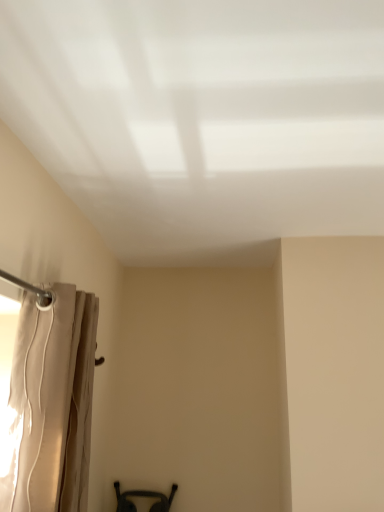
The image size is (384, 512). Describe the element at coordinates (53, 401) in the screenshot. I see `beige fabric curtain at left` at that location.

Find the location of a particular element. beige fabric curtain at left is located at coordinates (53, 401).

I want to click on beige fabric curtain at left, so click(x=53, y=401).